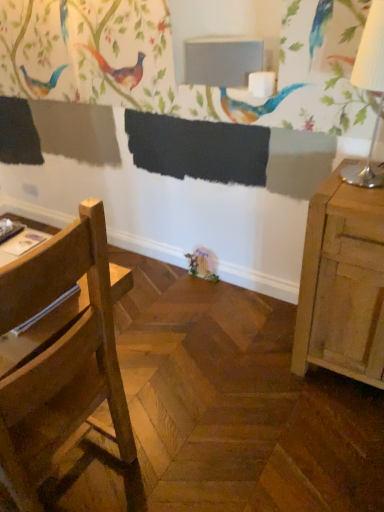
Question: From a real-world perspective, is white paper lampshade at right located higher than wooden chair at left?

Choices:
 (A) yes
 (B) no

Answer: (A)

Question: Considering the relative positions of white paper lampshade at right and wooden chair at left in the image provided, is white paper lampshade at right behind wooden chair at left?

Choices:
 (A) no
 (B) yes

Answer: (B)

Question: Is white paper lampshade at right oriented towards wooden chair at left?

Choices:
 (A) yes
 (B) no

Answer: (B)

Question: Is white paper lampshade at right closer to the viewer compared to wooden chair at left?

Choices:
 (A) no
 (B) yes

Answer: (A)

Question: Is white paper lampshade at right not within wooden chair at left?

Choices:
 (A) yes
 (B) no

Answer: (A)

Question: Can you confirm if white paper lampshade at right is shorter than wooden chair at left?

Choices:
 (A) yes
 (B) no

Answer: (A)

Question: Is matte gray table at upper center outside of wooden chair at left?

Choices:
 (A) yes
 (B) no

Answer: (A)

Question: From the image's perspective, is matte gray table at upper center on wooden chair at left?

Choices:
 (A) yes
 (B) no

Answer: (A)

Question: Is matte gray table at upper center positioned in front of wooden chair at left?

Choices:
 (A) no
 (B) yes

Answer: (A)

Question: Does matte gray table at upper center have a greater width compared to wooden chair at left?

Choices:
 (A) no
 (B) yes

Answer: (A)

Question: Is matte gray table at upper center far away from wooden chair at left?

Choices:
 (A) no
 (B) yes

Answer: (B)

Question: From a real-world perspective, is matte gray table at upper center positioned over wooden chair at left based on gravity?

Choices:
 (A) no
 (B) yes

Answer: (B)

Question: Does white paper lampshade at right come behind matte gray table at upper center?

Choices:
 (A) no
 (B) yes

Answer: (A)